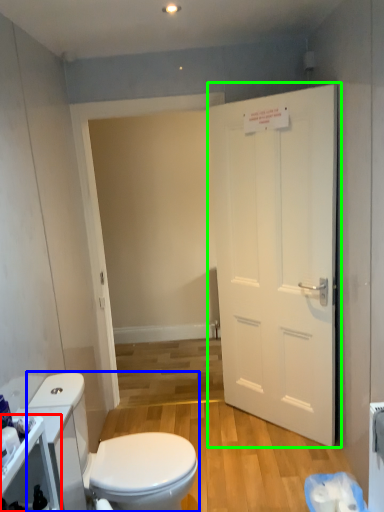
Question: Estimate the real-world distances between objects in this image. Which object is farther from cabinetry (highlighted by a red box), toilet (highlighted by a blue box) or door (highlighted by a green box)?

Choices:
 (A) toilet
 (B) door

Answer: (B)